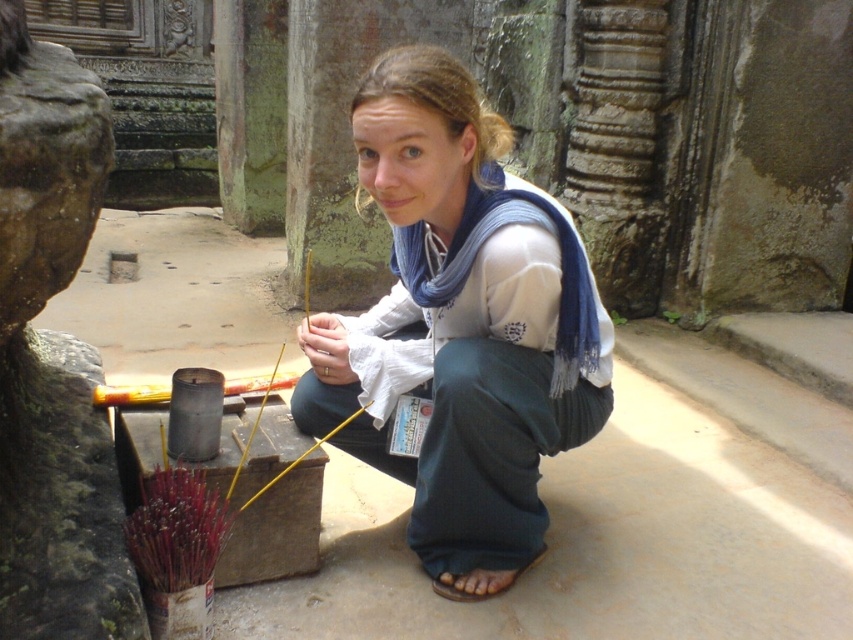
You are standing at the point with coordinates point (19, 339) and want to walk to the point (460, 122). Which direction should you move?

You should move forward because point (460, 122) is in front of point (19, 339).

You are standing at the entrance of the ancient stone structure and want to place a new offering on the smooth stone statue at left. However, there is a brown leather sandal at lower center in the way. Can you move the sandal to access the statue?

The smooth stone statue at left is in front of the brown leather sandal at lower center, meaning the sandal is behind the statue. Therefore, you don not need to move the sandal to access the statue since it is already positioned behind the statue.